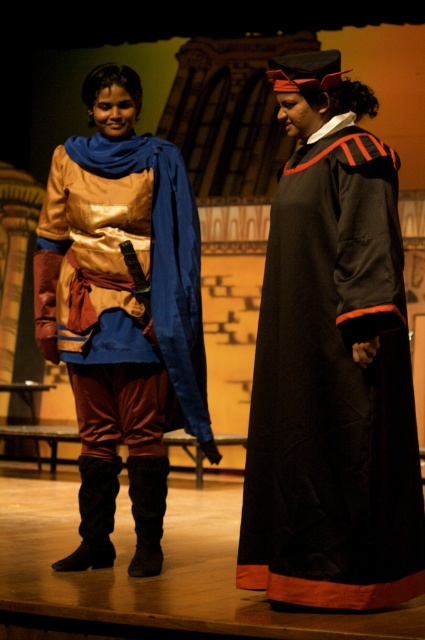
Is black velvet gown at right behind shiny gold tunic at center?

No, it is in front of shiny gold tunic at center.

Is point (387, 166) positioned in front of point (54, 220)?

That is True.

Is point (359, 241) less distant than point (99, 93)?

Yes.

At what (x,y) coordinates should I click in order to perform the action: click on black velvet gown at right. Please return your answer as a coordinate pair (x, y). The image size is (425, 640). Looking at the image, I should click on (333, 388).